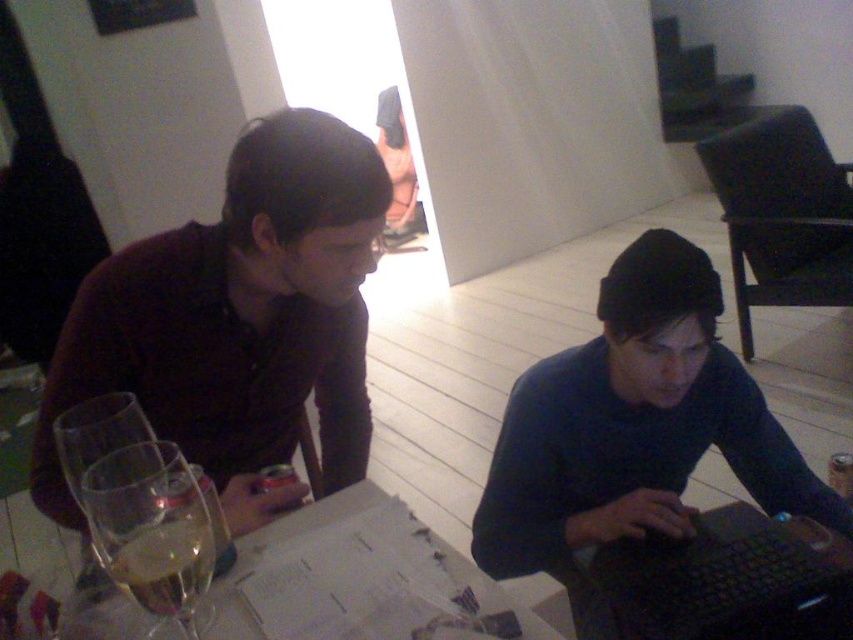
You are a server at a restaurant and need to choose a wine glass for a guest. You have two options on the table. The clear glass wine glass at lower left and the clear glass wine glass at left. Which one should you choose if the guest prefers a larger glass?

The clear glass wine glass at left is wider than the clear glass wine glass at lower left, so you should choose the clear glass wine glass at left for the guest who prefers a larger glass.

You are a photographer taking a picture of the scene. You want to ensure both the matte black shirt at left and the black matte laptop at lower right are clearly visible in the photo. Which object should you focus on first to ensure depth of field captures both?

You should focus on the matte black shirt at left first because it is closer to the viewer than the black matte laptop at lower right. By focusing on the closer object, the depth of field will extend backward, potentially keeping both in focus.

You are a bartender preparing drinks for a customer. You need to choose a wine glass that can hold more liquid. Which one should you select between the clear glass wine glass at lower left and the clear glass wine glass at left?

The clear glass wine glass at left can hold more liquid because it has a greater height compared to the clear glass wine glass at lower left.